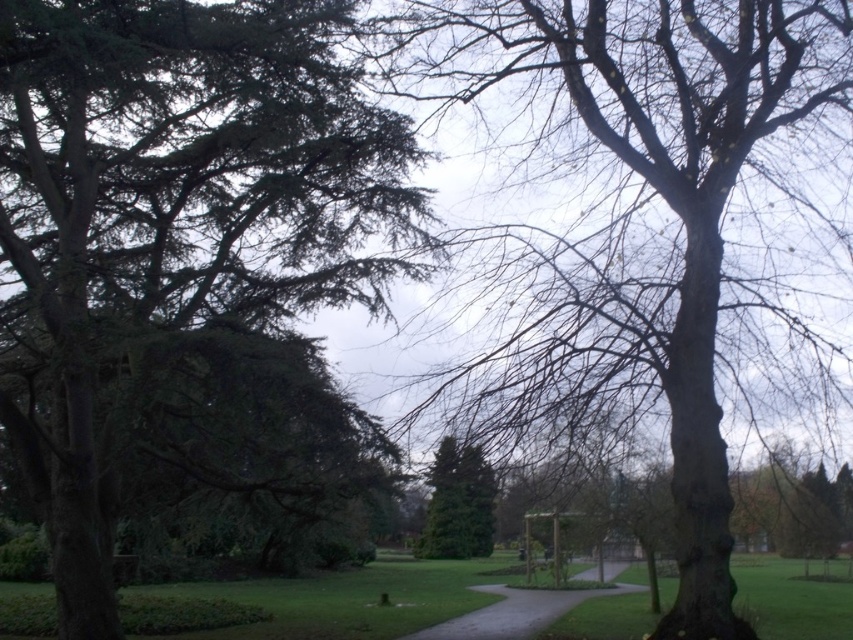
You are a park visitor wanting to take a photo of the smooth bark tree at center and the smooth asphalt path at center. Which object should you focus on first if you want to capture both in one frame without moving the camera?

The smooth asphalt path at center is taller than the smooth bark tree at center, so you should focus on the smooth asphalt path at center first to ensure both are in the frame.

You are standing in the park and want to reach the point marked as point (471, 3). If you can walk 10 feet per minute, how many minutes will it take you to reach that point?

The distance between you and point (471, 3) is 39.53 feet. At a walking speed of 10 feet per minute, it would take approximately 3.95 minutes to reach the point.